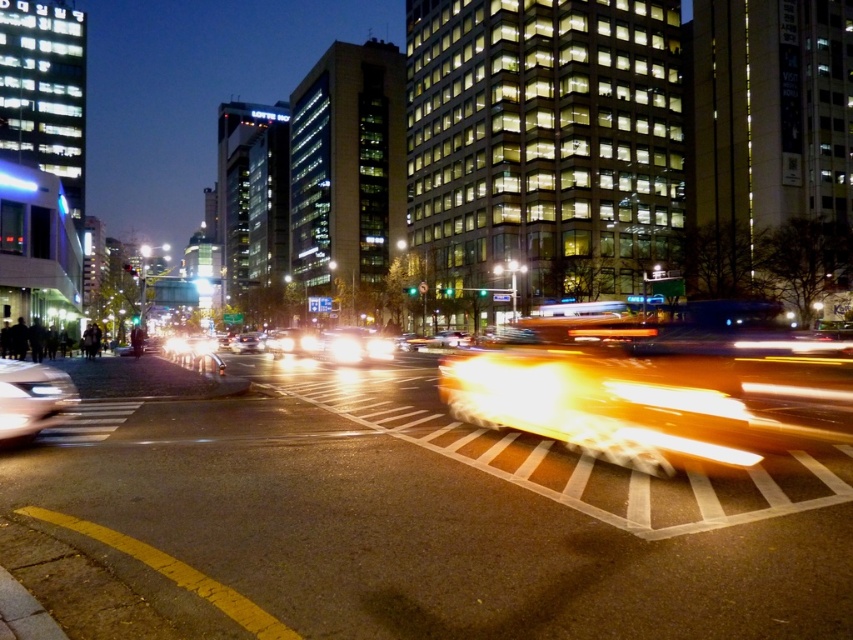
You are a delivery driver who needs to park your vehicle between the shiny silver car at lower left and the shiny silver sedan at center. Given that your delivery van is 5 meters long, is there enough space between them to park your van without overlapping either vehicle?

The distance between the shiny silver car at lower left and the shiny silver sedan at center is 48.91 meters. Since your delivery van is only 5 meters long, there is ample space to park between them without overlapping either vehicle.

You are a parking attendant who needs to park both the shiny silver car at lower left and the shiny silver sedan at center in a parking spot that is 5 meters wide. Can both vehicles fit side by side in the spot?

The shiny silver car at lower left is narrower than the shiny silver sedan at center, but their combined widths must be compared to the 5 meter spot. However, since the exact widths aren

You are a delivery driver who needs to navigate through the street. You see a shiny silver car at lower left and a dark gray concrete crowd at lower left. How far apart are these two objects in meters?

The shiny silver car at lower left and the dark gray concrete crowd at lower left are 23.03 meters apart from each other.